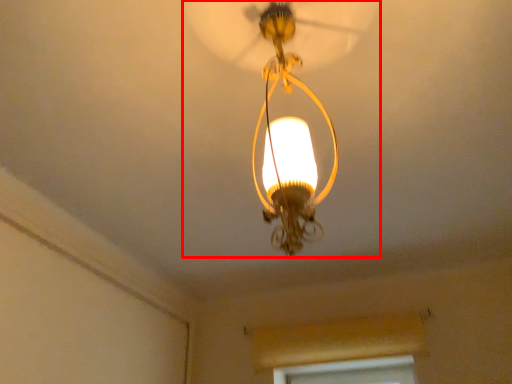
Question: In this image, where is lamp (annotated by the red box) located relative to window frame?

Choices:
 (A) left
 (B) right

Answer: (A)